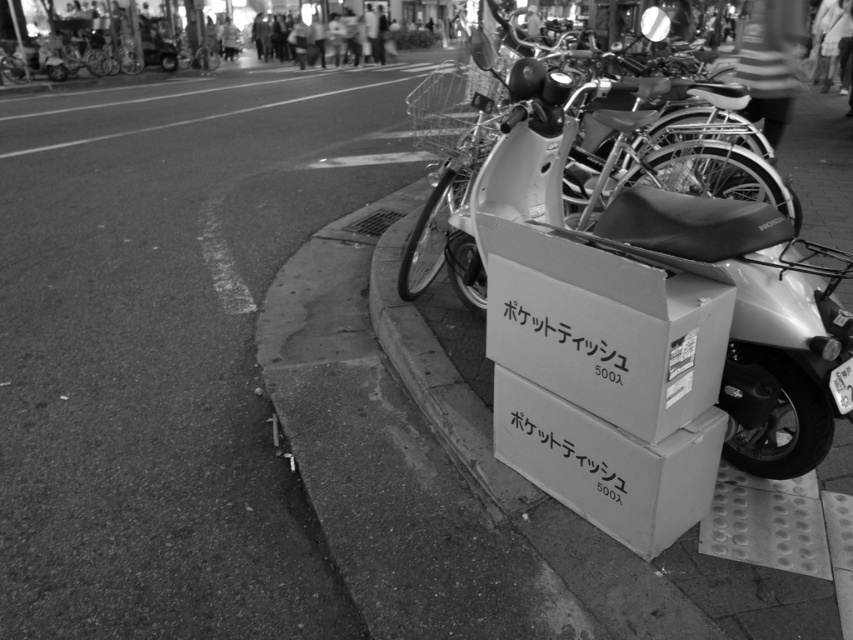
Is cardboard box at center shorter than white cardboard box at center?

Incorrect, cardboard box at center's height does not fall short of white cardboard box at center's.

Does cardboard box at center have a larger size compared to white cardboard box at center?

Yes.

I want to click on cardboard box at center, so click(x=605, y=326).

Can you confirm if white cardboard box at center is smaller than white cardboard box at lower right?

Yes, white cardboard box at center is smaller than white cardboard box at lower right.

Who is taller, white cardboard box at center or white cardboard box at lower right?

white cardboard box at lower right

Is point (517, 298) positioned in front of point (619, 508)?

That is False.

Image resolution: width=853 pixels, height=640 pixels. Find the location of `white cardboard box at center`. white cardboard box at center is located at coordinates (x=561, y=339).

Between cardboard box at center and white matte motorcycle at center, which one appears on the left side from the viewer's perspective?

white matte motorcycle at center

Is point (508, 221) farther from camera compared to point (796, 200)?

No.

Who is more distant from viewer, [656,348] or [440,148]?

Point [440,148]

Locate an element on the screen. This screenshot has height=640, width=853. cardboard box at center is located at coordinates (605, 326).